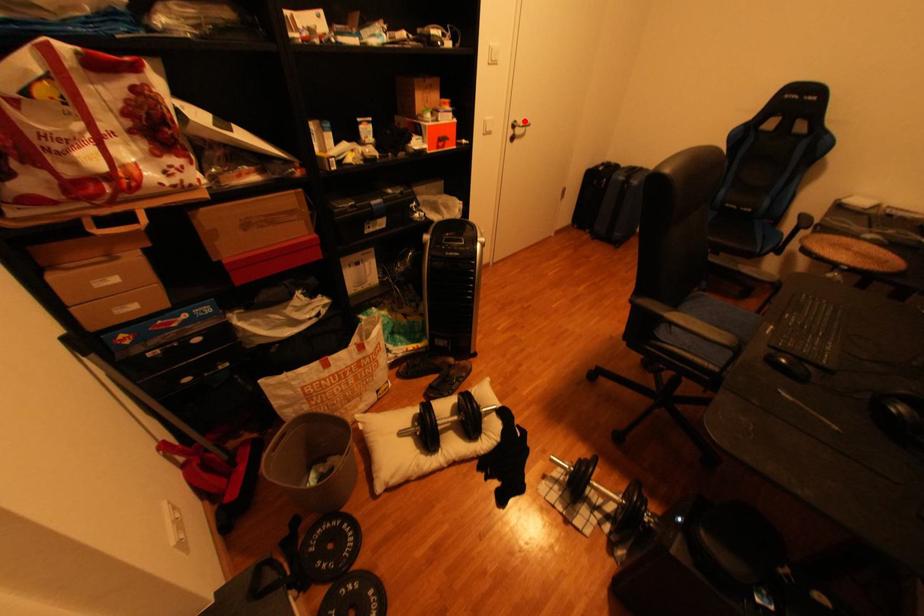
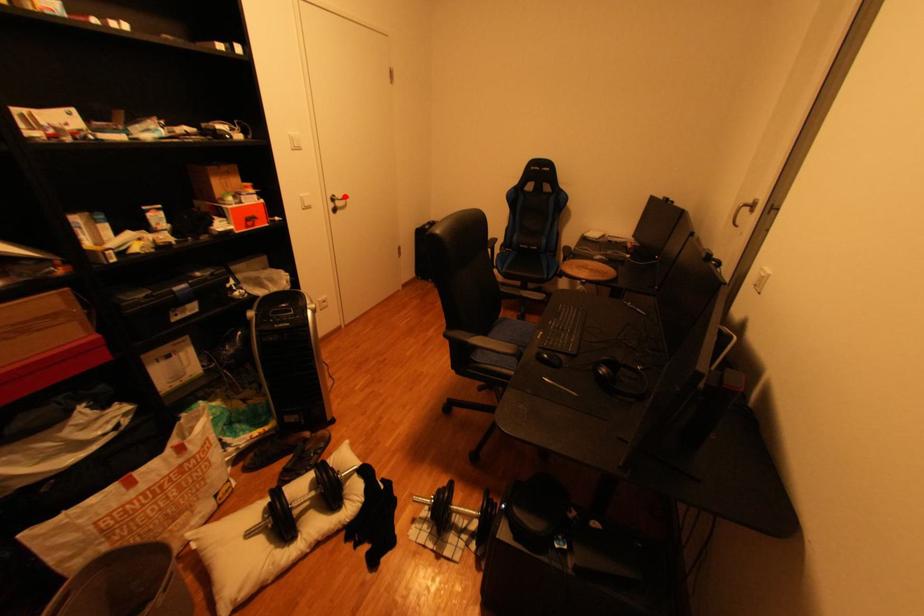
I am providing you with two images of the same scene from different viewpoints. A red point is marked on the first image and another point is marked on the second image. Are the points marked in image1 and image2 representing the same 3D position?

Yes